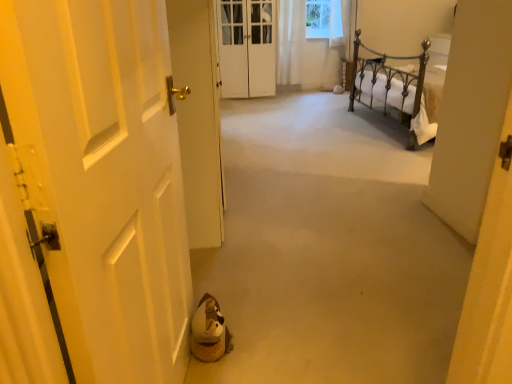
This screenshot has width=512, height=384. I want to click on vacant area on top of beige carpet at center (from a real-world perspective), so click(294, 157).